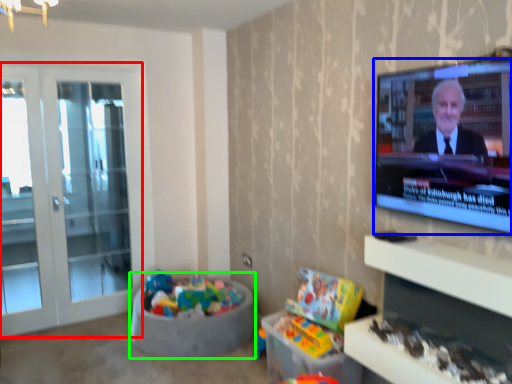
Question: Which object is the farthest from screen door (highlighted by a red box)? Choose among these: television (highlighted by a blue box) or bean bag chair (highlighted by a green box).

Choices:
 (A) television
 (B) bean bag chair

Answer: (A)